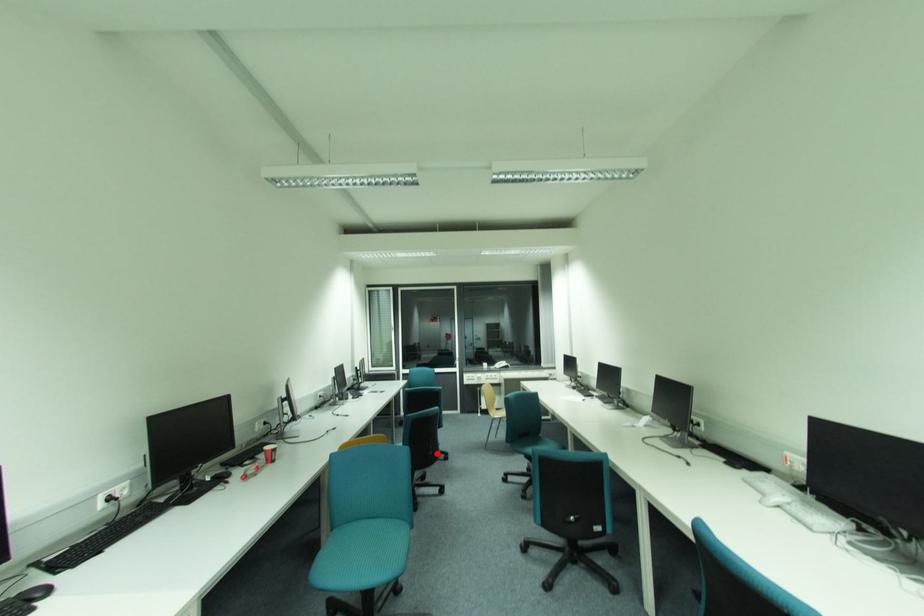
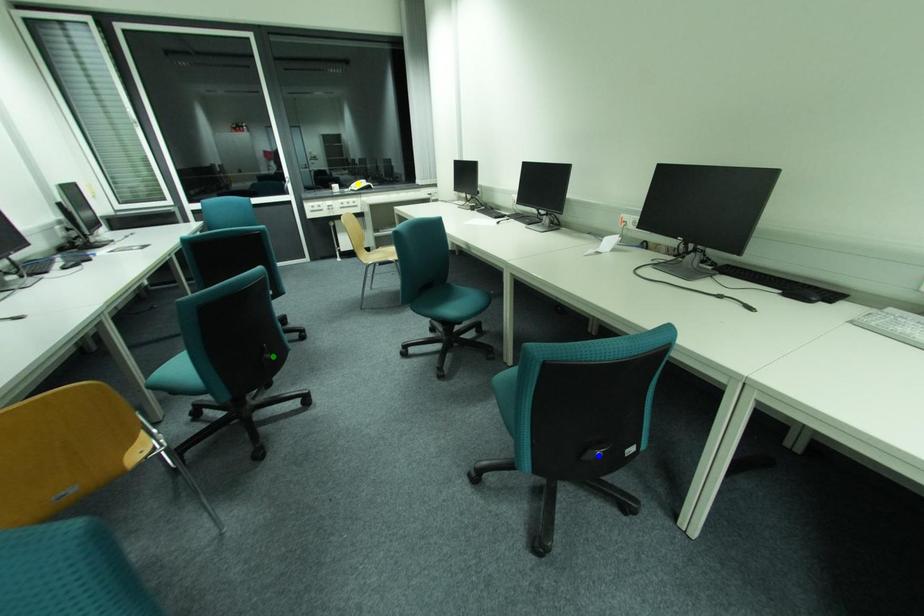
Question: I am providing you with two images of the same scene from different viewpoints. A red point is marked on the first image. You are given multiple points on the second image. Which mark in image 2 goes with the point in image 1?

Choices:
 (A) blue point
 (B) yellow point
 (C) green point

Answer: (C)